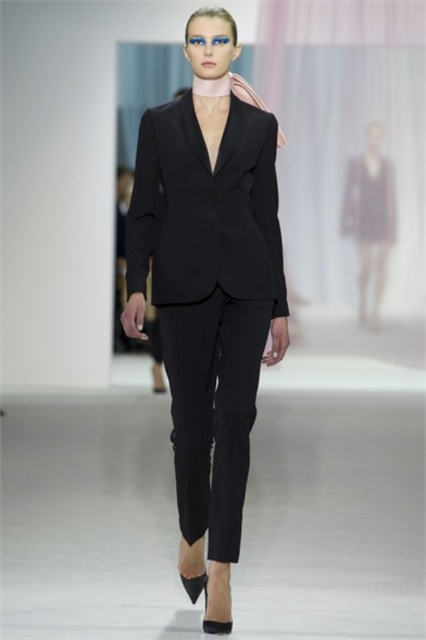
Between matte black dress at right and purple satin dress at center, which one has more height?

matte black dress at right

Who is lower down, matte black dress at right or purple satin dress at center?

matte black dress at right is lower down.

You are a GUI agent. You are given a task and a screenshot of the screen. Output one action in this format:
    pyautogui.click(x=<x>, y=<y>)
    Task: Click on the matte black dress at right
    The image size is (426, 640).
    Given the screenshot: What is the action you would take?
    (370, 218)

Image resolution: width=426 pixels, height=640 pixels. I want to click on matte black dress at right, so click(370, 218).

Between matte black suit at center and purple satin dress at center, which one has less height?

Standing shorter between the two is purple satin dress at center.

Which is behind, point (207, 504) or point (348, 164)?

Positioned behind is point (348, 164).

Where is `matte black suit at center`? The image size is (426, 640). matte black suit at center is located at coordinates (209, 291).

Which of these two, matte black suit at center or matte black dress at right, stands shorter?

matte black dress at right is shorter.

Which is more to the left, matte black suit at center or matte black dress at right?

Positioned to the left is matte black suit at center.

What are the coordinates of `matte black suit at center` in the screenshot? It's located at (209, 291).

Where is `matte black suit at center`? The height and width of the screenshot is (640, 426). matte black suit at center is located at coordinates (209, 291).